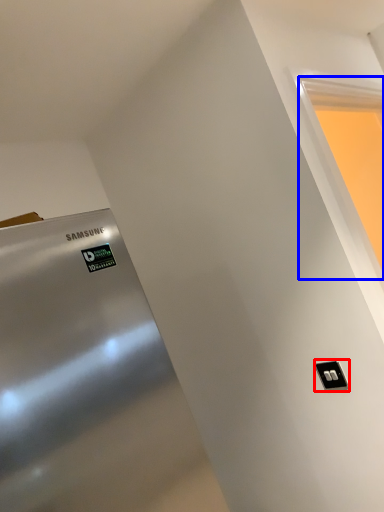
Question: Which point is further to the camera, light switch (highlighted by a red box) or window (highlighted by a blue box)?

Choices:
 (A) light switch
 (B) window

Answer: (A)